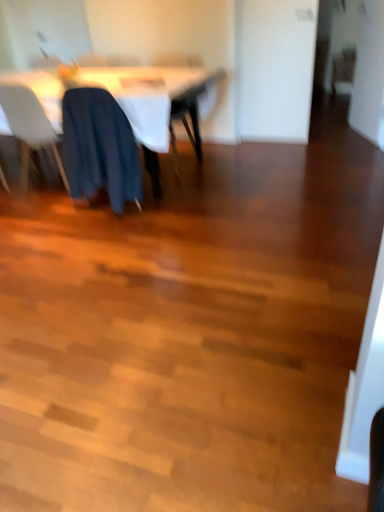
Identify the location of vacant space in front of white fabric table at upper left. This screenshot has width=384, height=512. (137, 271).